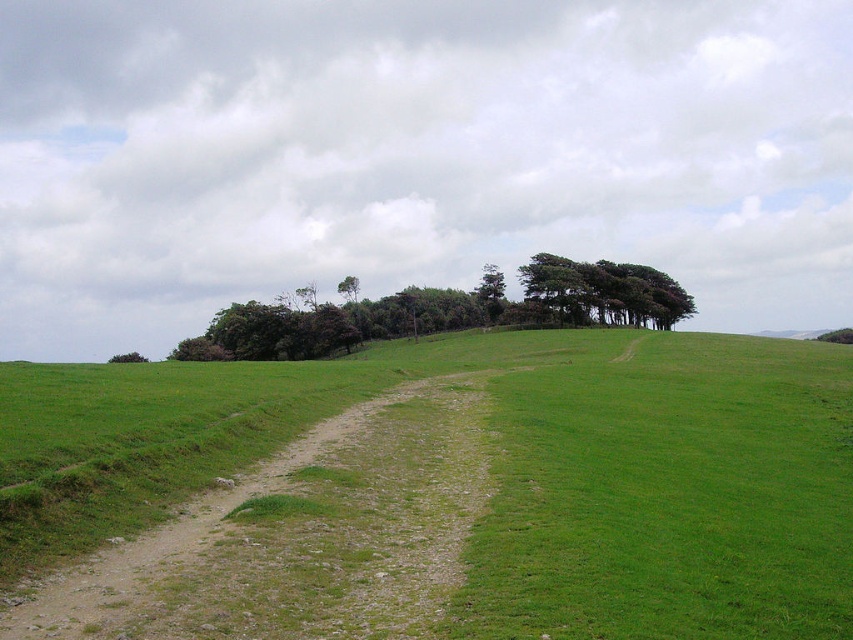
Question: Among these objects, which one is nearest to the camera?

Choices:
 (A) green leafy tree at right
 (B) green grassy at center
 (C) green leafy tree at center
 (D) dark green textured trees at upper center

Answer: (B)

Question: Estimate the real-world distances between objects in this image. Which object is farther from the dark green textured trees at upper center?

Choices:
 (A) green leafy tree at center
 (B) green grassy at center
 (C) green leafy tree at right

Answer: (A)

Question: Does green grassy at center have a smaller size compared to dark green textured trees at upper center?

Choices:
 (A) no
 (B) yes

Answer: (B)

Question: Does green grassy at center lie behind green leafy tree at right?

Choices:
 (A) yes
 (B) no

Answer: (B)

Question: Which of these objects is positioned farthest from the green leafy tree at right?

Choices:
 (A) dark green textured trees at upper center
 (B) green grassy at center

Answer: (B)

Question: Observing the image, what is the correct spatial positioning of dark green textured trees at upper center in reference to green leafy tree at right?

Choices:
 (A) right
 (B) left

Answer: (B)